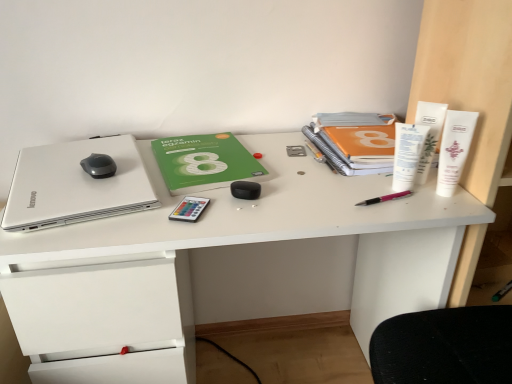
Locate an element on the screen. vacant point to the right of black rubberized mouse at upper left is located at coordinates (130, 173).